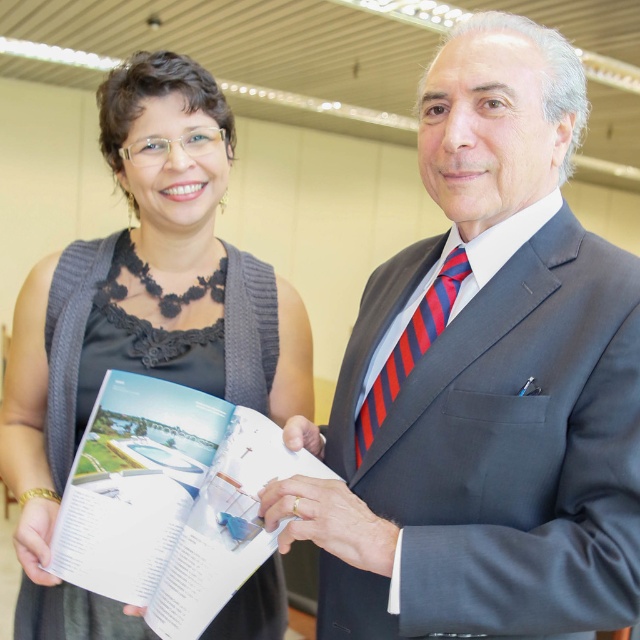
You are at a formal event and want to take a photo with both the black knitted sweater at left and the red striped tie at center. Which one should you stand closer to if you want them both to appear in the frame?

You should stand closer to the black knitted sweater at left because it is positioned on the left side of the red striped tie at center, so moving closer to it would help ensure both objects are in the frame.

You are attending a formal event and want to take a photo of the red striped tie at center without the black knitted sweater at left blocking it. How should you position yourself to achieve this?

The red striped tie at center is behind the black knitted sweater at left, so to avoid the sweater blocking the view, you should move to a position where you can see around or behind the sweater to capture the tie directly.

Based on the photo, you are a fashion designer observing the two individuals at a formal event. You need to determine which item of clothing is wider between the matte gray suit at center and the red striped tie at center. Which one is wider?

The matte gray suit at center is wider than the red striped tie at center according to the description.